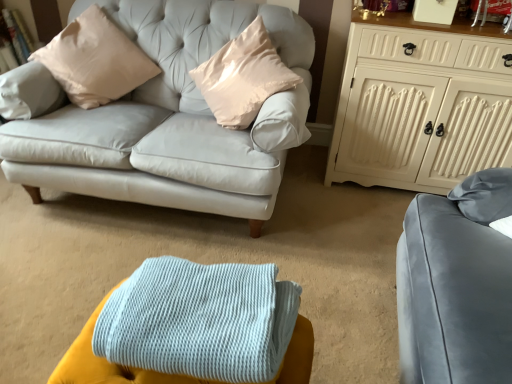
Question: Is satin beige pillow at upper left positioned far away from light blue knitted blanket at lower center?

Choices:
 (A) yes
 (B) no

Answer: (A)

Question: From a real-world perspective, is satin beige pillow at upper left beneath light blue knitted blanket at lower center?

Choices:
 (A) no
 (B) yes

Answer: (A)

Question: Is satin beige pillow at upper left thinner than light blue knitted blanket at lower center?

Choices:
 (A) yes
 (B) no

Answer: (B)

Question: Considering the relative positions of satin beige pillow at upper left and light blue knitted blanket at lower center in the image provided, is satin beige pillow at upper left in front of light blue knitted blanket at lower center?

Choices:
 (A) no
 (B) yes

Answer: (A)

Question: Is satin beige pillow at upper left at the right side of light blue knitted blanket at lower center?

Choices:
 (A) no
 (B) yes

Answer: (A)

Question: Considering the relative sizes of satin beige pillow at upper left and light blue knitted blanket at lower center in the image provided, is satin beige pillow at upper left bigger than light blue knitted blanket at lower center?

Choices:
 (A) yes
 (B) no

Answer: (A)

Question: Can you confirm if white painted wood cabinet at upper right is bigger than satin beige pillow at upper left?

Choices:
 (A) yes
 (B) no

Answer: (A)

Question: Is white painted wood cabinet at upper right positioned behind satin beige pillow at upper left?

Choices:
 (A) no
 (B) yes

Answer: (A)

Question: From a real-world perspective, is white painted wood cabinet at upper right on satin beige pillow at upper left?

Choices:
 (A) no
 (B) yes

Answer: (A)

Question: Is white painted wood cabinet at upper right positioned in front of satin beige pillow at upper left?

Choices:
 (A) yes
 (B) no

Answer: (A)

Question: Does white painted wood cabinet at upper right appear on the left side of satin beige pillow at upper left?

Choices:
 (A) yes
 (B) no

Answer: (B)

Question: Can you confirm if white painted wood cabinet at upper right is smaller than satin beige pillow at upper left?

Choices:
 (A) no
 (B) yes

Answer: (A)

Question: From a real-world perspective, is light blue knitted blanket at lower center on top of white painted wood cabinet at upper right?

Choices:
 (A) yes
 (B) no

Answer: (B)